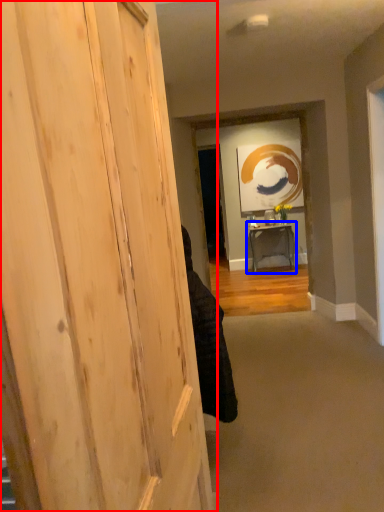
Question: Which object appears closest to the camera in this image, door (highlighted by a red box) or table (highlighted by a blue box)?

Choices:
 (A) door
 (B) table

Answer: (A)